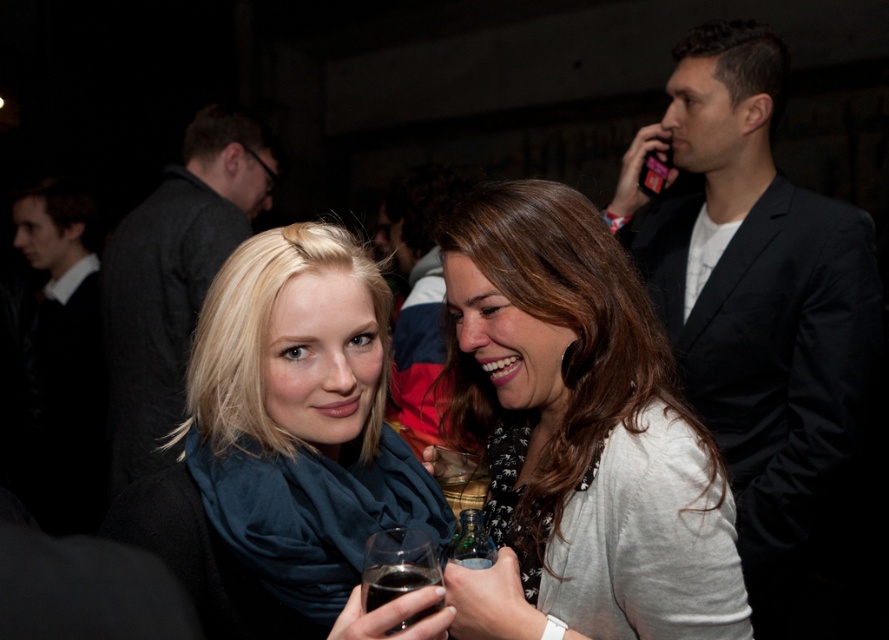
Does matte blue scarf at center have a lesser width compared to dark glass at lower center?

No, matte blue scarf at center is not thinner than dark glass at lower center.

Where is `matte blue scarf at center`? The width and height of the screenshot is (889, 640). matte blue scarf at center is located at coordinates (282, 442).

This screenshot has width=889, height=640. Identify the location of matte blue scarf at center. (282, 442).

In the scene shown: Does dark gray suit at left have a lesser height compared to translucent glass bottle at center?

In fact, dark gray suit at left may be taller than translucent glass bottle at center.

Does dark gray suit at left have a smaller size compared to translucent glass bottle at center?

No, dark gray suit at left is not smaller than translucent glass bottle at center.

From the picture: Who is more distant from viewer, (x=164, y=275) or (x=483, y=552)?

Point (x=164, y=275)

Find the location of `dark gray suit at left`. dark gray suit at left is located at coordinates (174, 276).

Is matte white sweater at center wider than translucent glass bottle at center?

Indeed, matte white sweater at center has a greater width compared to translucent glass bottle at center.

Is the position of matte white sweater at center more distant than that of translucent glass bottle at center?

No, matte white sweater at center is in front of translucent glass bottle at center.

Is point (473, 227) behind point (483, 564)?

That is True.

Locate an element on the screen. The height and width of the screenshot is (640, 889). matte white sweater at center is located at coordinates tap(578, 433).